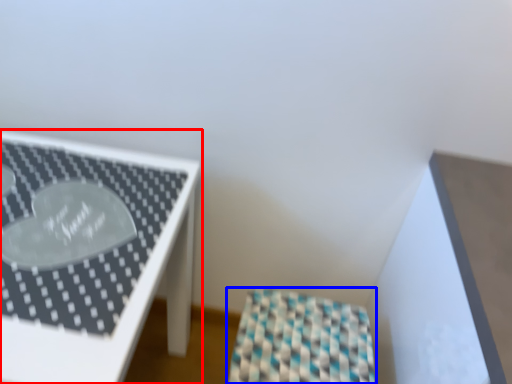
Question: Which point is further to the camera, furniture (highlighted by a red box) or furniture (highlighted by a blue box)?

Choices:
 (A) furniture
 (B) furniture

Answer: (B)